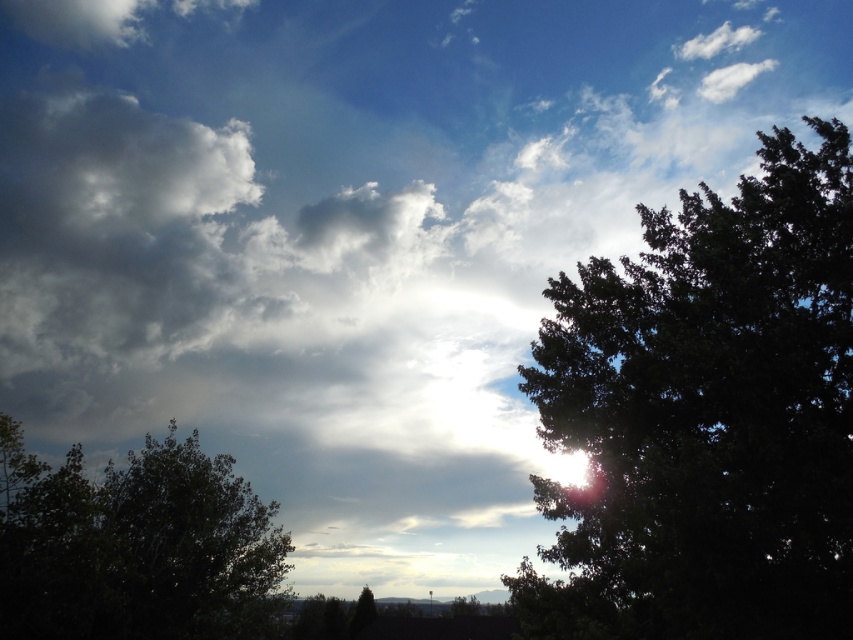
You are standing in a park and see the green leafy tree at right. If you want to take a photo of it with your smartphone camera, which has a maximum zoom range of 10 meters, will you be able to capture the entire tree without moving closer?

The green leafy tree at right is 16.48 meters away from the viewer. Since the smartphone camera has a maximum zoom range of 10 meters, you will not be able to capture the entire tree without moving closer.

You are an ornithologist observing birds in the area. You notice a bird perched on the green leafy tree at right and another on the dark green leafy tree at lower left. Which tree is the smaller one where the bird is resting?

The green leafy tree at right is smaller in size compared to the dark green leafy tree at lower left, so the bird on the green leafy tree at right is resting on the smaller tree.

In the scene shown: You are standing in a field and see a point marked at coordinates (x=706, y=417). What does this point indicate?

The point at (x=706, y=417) marks the location of the green leafy tree at right.